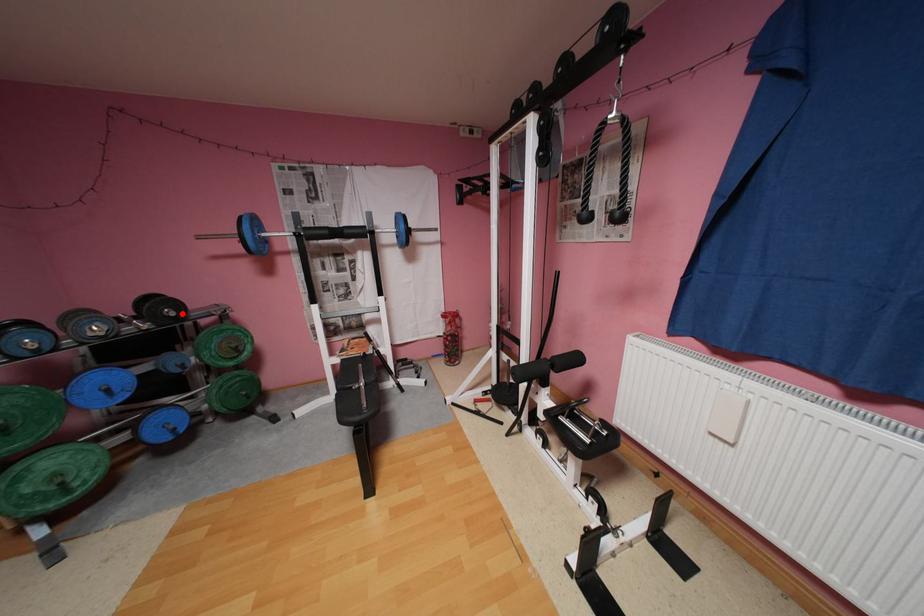
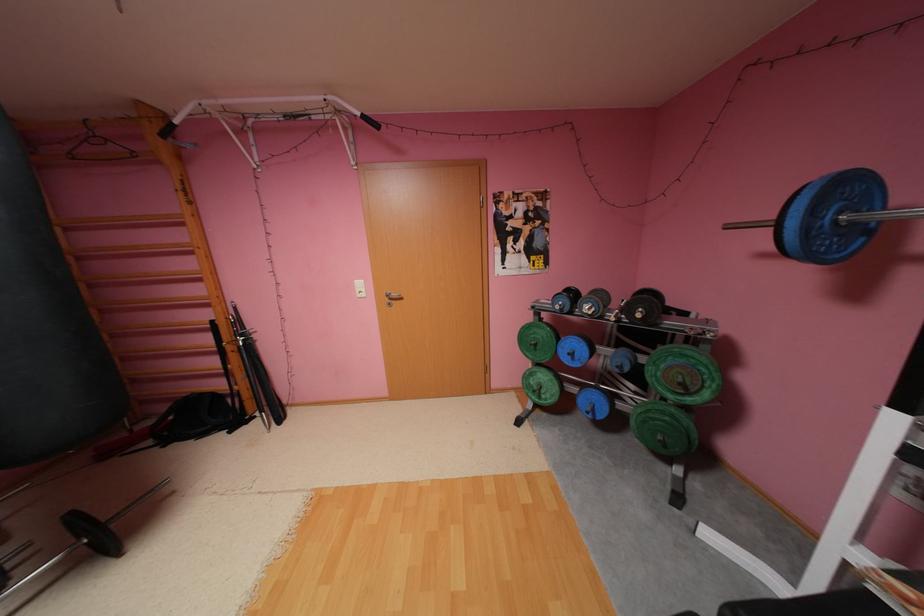
In the second image, find the point that corresponds to the highlighted location in the first image.

(648, 315)